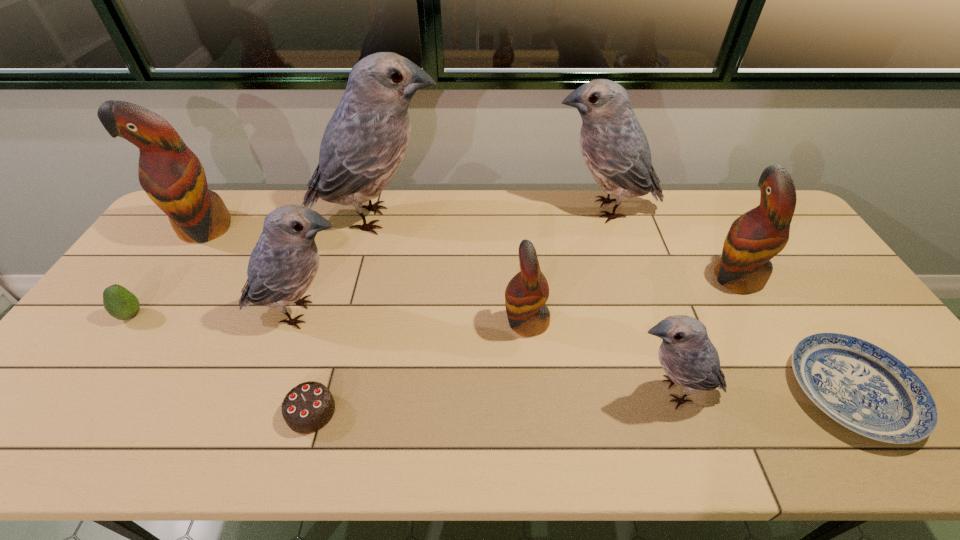
The width and height of the screenshot is (960, 540). In order to click on free region located on the front-facing side of the third smallest gray parrot in this screenshot , I will do `click(444, 210)`.

In order to click on vacant position located 0.230m on the front-facing side of the third smallest gray parrot in this screenshot , I will do `click(482, 210)`.

Identify the location of free space located 0.050m on the face of the leftmost parrot. The width and height of the screenshot is (960, 540). (182, 261).

At what (x,y) coordinates should I click in order to perform the action: click on vacant space located 0.110m on the face of the rightmost red parrot. Please return your answer as a coordinate pair (x, y). Image resolution: width=960 pixels, height=540 pixels. Looking at the image, I should click on (670, 278).

Where is `free space located 0.300m on the face of the rightmost red parrot`? The image size is (960, 540). free space located 0.300m on the face of the rightmost red parrot is located at coordinates (607, 278).

Identify the location of free space located 0.280m on the face of the rightmost red parrot. This screenshot has width=960, height=540. tap(613, 278).

You are a GUI agent. You are given a task and a screenshot of the screen. Output one action in this format:
    pyautogui.click(x=<x>, y=<y>)
    Task: Click on the vacant space located on the front-facing side of the second smallest gray parrot
    Image resolution: width=960 pixels, height=540 pixels.
    Given the screenshot: What is the action you would take?
    pyautogui.click(x=445, y=313)

This screenshot has width=960, height=540. I want to click on vacant space located 0.060m on the front-facing side of the nearest parrot, so click(x=597, y=392).

Image resolution: width=960 pixels, height=540 pixels. Identify the location of blank area located 0.230m on the front-facing side of the nearest parrot. 526,392.

The image size is (960, 540). Identify the location of blank space located 0.190m on the front-facing side of the nearest parrot. [x=542, y=392].